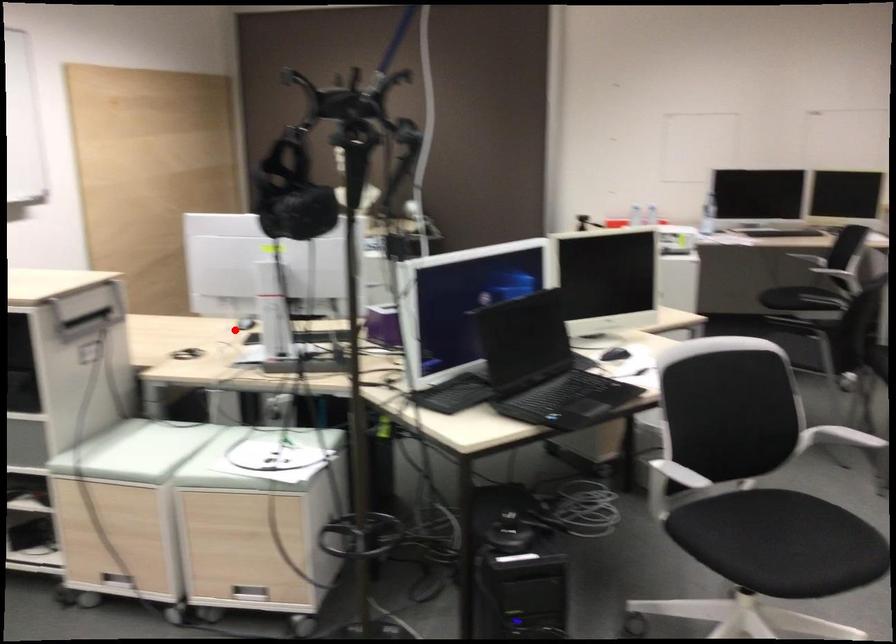
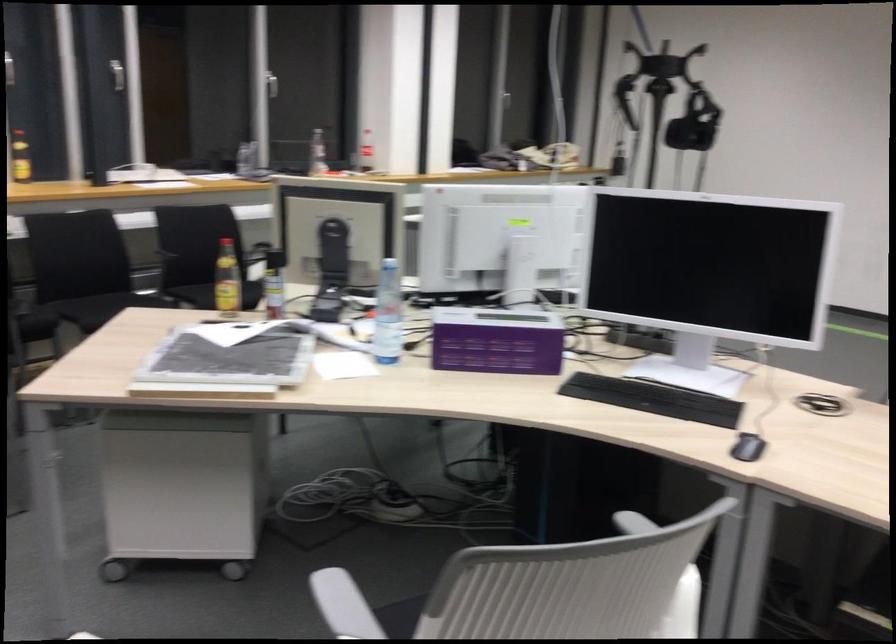
Question: I am providing you with two images of the same scene from different viewpoints. A red point is marked on the first image. At the location where the point appears in image 1, is it still visible in image 2?

Choices:
 (A) Yes
 (B) No

Answer: (A)